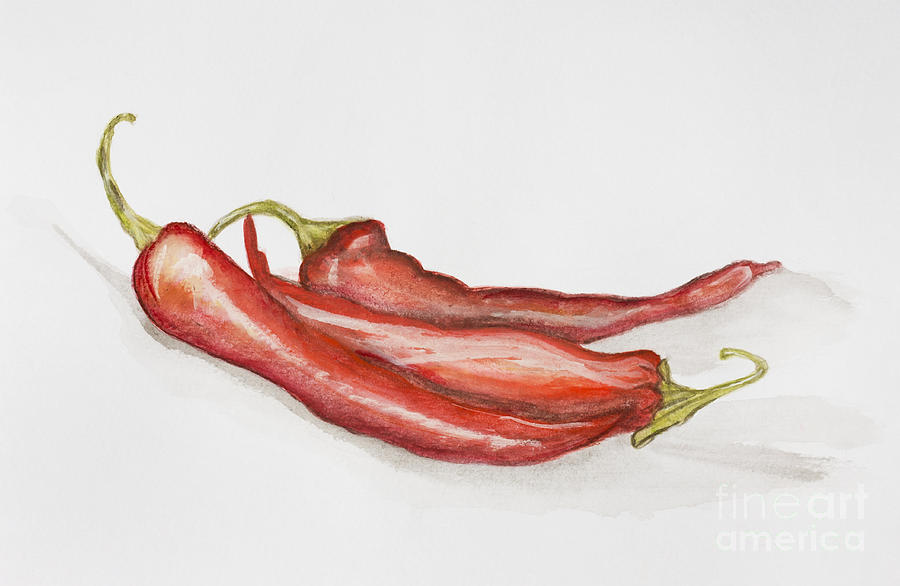
You are a GUI agent. You are given a task and a screenshot of the screen. Output one action in this format:
    pyautogui.click(x=<x>, y=<y>)
    Task: Click on the art deco
    This screenshot has height=586, width=900.
    Given the screenshot: What is the action you would take?
    pyautogui.click(x=415, y=338)